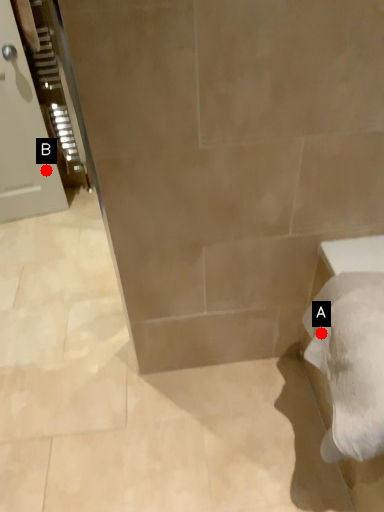
Question: Two points are circled on the image, labeled by A and B beside each circle. Which point is farther to the camera?

Choices:
 (A) A is further
 (B) B is further

Answer: (B)